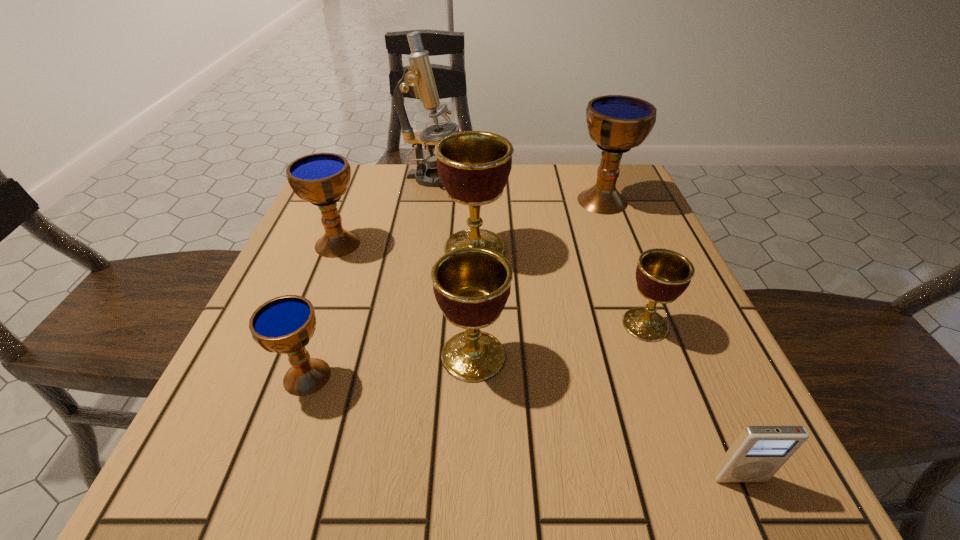
Find the location of `microscope`. microscope is located at coordinates (418, 80).

Where is `the biggest blue chalice`? Image resolution: width=960 pixels, height=540 pixels. the biggest blue chalice is located at coordinates (616, 123).

This screenshot has width=960, height=540. Identify the location of the farthest blue chalice. (616, 123).

Find the location of `the farthest golden chalice`. the farthest golden chalice is located at coordinates (474, 166).

You are a GUI agent. You are given a task and a screenshot of the screen. Output one action in this format:
    pyautogui.click(x=<x>, y=<y>)
    Task: Click on the second smallest blue chalice
    The image size is (960, 540).
    Given the screenshot: What is the action you would take?
    pyautogui.click(x=321, y=178)

Image resolution: width=960 pixels, height=540 pixels. I want to click on the second smallest golden chalice, so click(x=471, y=285).

The image size is (960, 540). Identify the location of the smallest golden chalice. (662, 275).

Locate an element on the screen. the smallest blue chalice is located at coordinates (285, 324).

The image size is (960, 540). In order to click on iPod in this screenshot , I will do `click(758, 452)`.

Where is `the shortest object`? This screenshot has height=540, width=960. the shortest object is located at coordinates (758, 452).